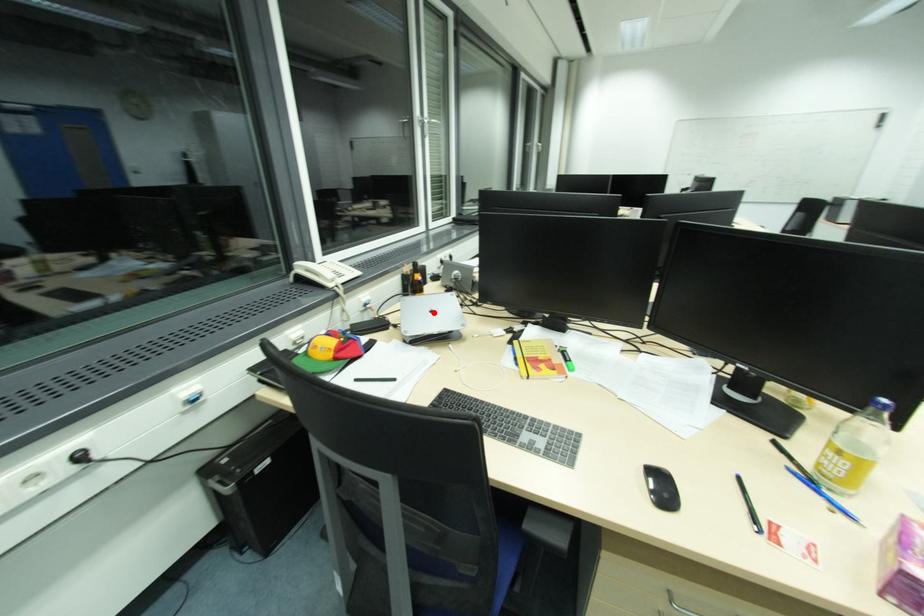
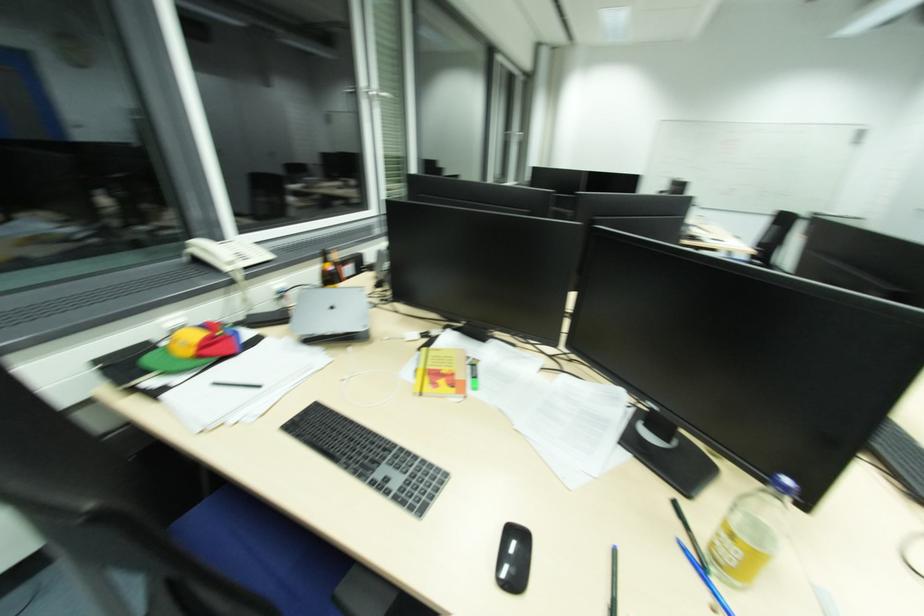
Question: I am providing you with two images of the same scene from different viewpoints. Given a red point in image1, look at the same physical point in image2. Is it:

Choices:
 (A) Closer to the viewpoint
 (B) Farther from the viewpoint

Answer: (A)